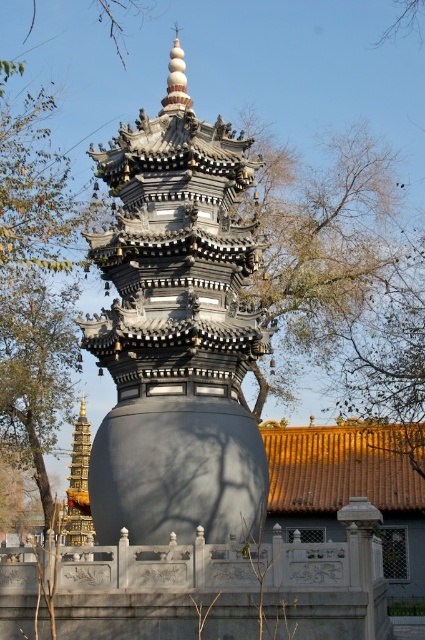
Question: Which point appears closest to the camera in this image?

Choices:
 (A) (82, 445)
 (B) (62, 301)
 (C) (252, 525)

Answer: (C)

Question: Considering the relative positions of green leafy tree at left and gold polished tower at lower left in the image provided, where is green leafy tree at left located with respect to gold polished tower at lower left?

Choices:
 (A) right
 (B) left

Answer: (B)

Question: Which is nearer to the matte black pagoda at center?

Choices:
 (A) green leafy tree at left
 (B) gold polished tower at lower left

Answer: (A)

Question: Which point appears farthest from the camera in this image?

Choices:
 (A) (79, 422)
 (B) (113, 470)
 (C) (14, 381)

Answer: (A)

Question: Does matte black pagoda at center appear on the right side of gold polished tower at lower left?

Choices:
 (A) yes
 (B) no

Answer: (A)

Question: Does matte black pagoda at center lie in front of gold polished tower at lower left?

Choices:
 (A) no
 (B) yes

Answer: (B)